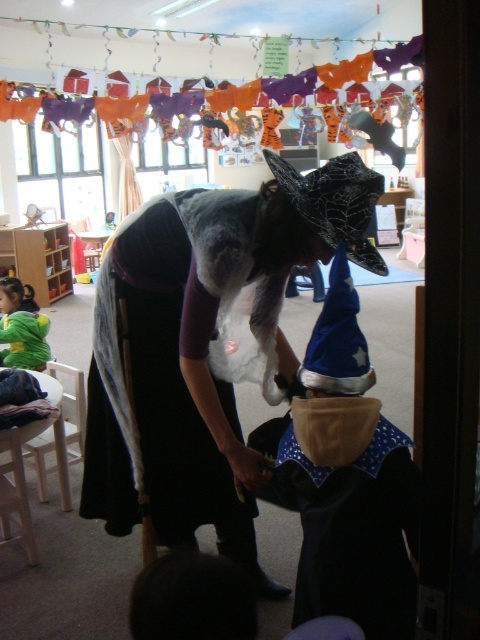
Question: Among these points, which one is farthest from the camera?

Choices:
 (A) (0, 353)
 (B) (255, 474)
 (C) (289, 472)

Answer: (A)

Question: Is blue felt hat at center to the left of green fuzzy sweater at lower left from the viewer's perspective?

Choices:
 (A) no
 (B) yes

Answer: (A)

Question: Considering the real-world distances, which object is farthest from the blue felt hat at center?

Choices:
 (A) green fuzzy sweater at lower left
 (B) velvet black cape at center

Answer: (A)

Question: Does blue felt hat at center lie in front of green fuzzy sweater at lower left?

Choices:
 (A) no
 (B) yes

Answer: (B)

Question: Which object appears closest to the camera in this image?

Choices:
 (A) velvet black cape at center
 (B) green fuzzy sweater at lower left
 (C) blue felt hat at center

Answer: (C)

Question: Is blue felt hat at center to the right of green fuzzy sweater at lower left from the viewer's perspective?

Choices:
 (A) no
 (B) yes

Answer: (B)